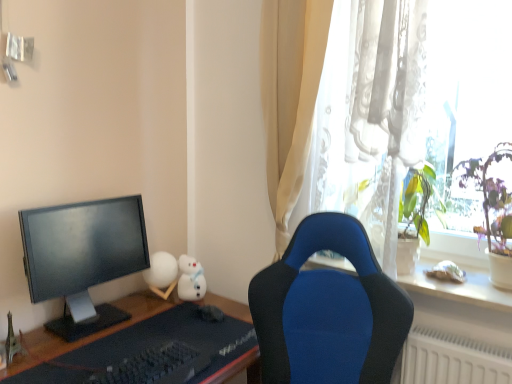
Find the location of `vacant space behind metallic silver eiffel tower at lower left, arranged as the 1th toy when viewed from the left`. vacant space behind metallic silver eiffel tower at lower left, arranged as the 1th toy when viewed from the left is located at coordinates (x=42, y=335).